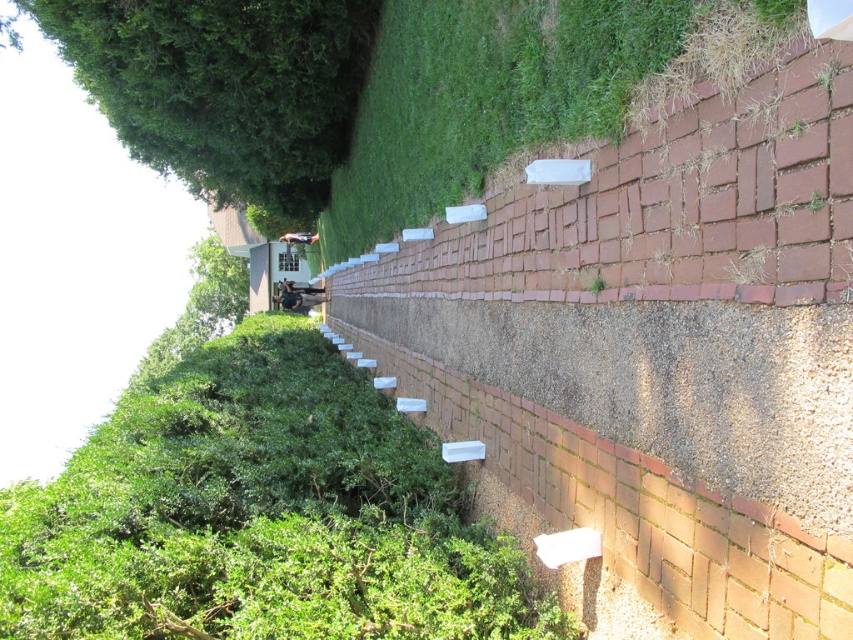
Does green leafy hedge at center come behind green grass at center?

That is True.

Is green leafy hedge at center taller than green grass at center?

No, green leafy hedge at center is not taller than green grass at center.

Between point (109, 417) and point (688, 88), which one is positioned behind?

The point (109, 417) is more distant.

Identify the location of green leafy hedge at center. The image size is (853, 640). (259, 513).

Between green leafy hedge at center and dark gray fabric man at center, which one has less height?

Answer: dark gray fabric man at center is shorter.

Does green leafy hedge at center appear under dark gray fabric man at center?

Correct, green leafy hedge at center is located below dark gray fabric man at center.

Where is `green leafy hedge at center`? This screenshot has width=853, height=640. green leafy hedge at center is located at coordinates (259, 513).

Can you confirm if green leafy tree at upper left is positioned to the right of dark gray fabric man at center?

Correct, you'll find green leafy tree at upper left to the right of dark gray fabric man at center.

Does green leafy tree at upper left appear on the left side of dark gray fabric man at center?

Incorrect, green leafy tree at upper left is not on the left side of dark gray fabric man at center.

The width and height of the screenshot is (853, 640). I want to click on green leafy tree at upper left, so (224, 88).

Find the location of `green leafy tree at upper left`. green leafy tree at upper left is located at coordinates (224, 88).